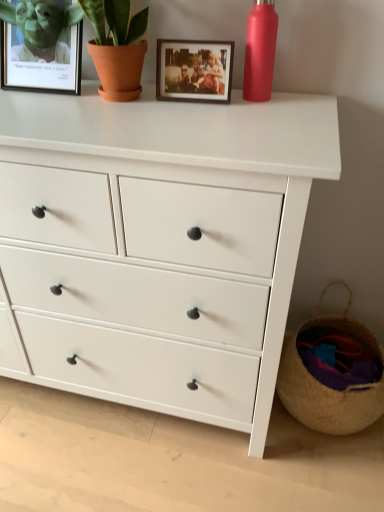
In order to face wooden photo frame at upper center, which is counted as the 2th picture frame, starting from the left, should I rotate leftwards or rightwards?

Turn right by 0.069 degrees to look at wooden photo frame at upper center, which is counted as the 2th picture frame, starting from the left.

What do you see at coordinates (156, 246) in the screenshot? The image size is (384, 512). I see `white matte chest of drawers at center` at bounding box center [156, 246].

You are a GUI agent. You are given a task and a screenshot of the screen. Output one action in this format:
    pyautogui.click(x=<x>, y=<y>)
    Task: Click on the woven straw basket at lower right
    This screenshot has height=512, width=384.
    Given the screenshot: What is the action you would take?
    pyautogui.click(x=332, y=373)

Considering the points (176, 95) and (146, 207), which point is behind, point (176, 95) or point (146, 207)?

Point (176, 95)

Is wooden photo frame at upper center, which is counted as the 2th picture frame, starting from the left, spatially inside white matte chest of drawers at center, or outside of it?

wooden photo frame at upper center, which is counted as the 2th picture frame, starting from the left, is spatially situated outside white matte chest of drawers at center.

Could you tell me if wooden photo frame at upper center, which is counted as the 2th picture frame, starting from the left, is facing white matte chest of drawers at center?

No, wooden photo frame at upper center, which is counted as the 2th picture frame, starting from the left, is not facing towards white matte chest of drawers at center.

From the image's perspective, between wooden photo frame at upper center, which is counted as the 2th picture frame, starting from the left, and white matte chest of drawers at center, which one is located above?

wooden photo frame at upper center, which is counted as the 2th picture frame, starting from the left, is shown above in the image.

Choose the correct answer: Is wooden photo frame at upper center, the 1th picture frame from the right, inside woven straw basket at lower right or outside it?

wooden photo frame at upper center, the 1th picture frame from the right, is outside woven straw basket at lower right.

Could you tell me if wooden photo frame at upper center, which is counted as the 2th picture frame, starting from the left, is turned towards woven straw basket at lower right?

No, wooden photo frame at upper center, which is counted as the 2th picture frame, starting from the left, is not turned towards woven straw basket at lower right.

From the image's perspective, between wooden photo frame at upper center, the 1th picture frame from the right, and woven straw basket at lower right, who is located below?

From the image's view, woven straw basket at lower right is below.

From a real-world perspective, is wooden photo frame at upper center, the 1th picture frame from the right, physically located above or below woven straw basket at lower right?

In terms of real-world spatial position, wooden photo frame at upper center, the 1th picture frame from the right, is above woven straw basket at lower right.

From a real-world perspective, which picture frame is the 2nd one above the white matte chest of drawers at center? Please provide its 2D coordinates.

[(41, 45)]

Based on the photo, from a real-world perspective, is white matte chest of drawers at center positioned over matte black picture frame at upper left, the 2th picture frame viewed from the right, based on gravity?

Incorrect, from a real-world perspective, white matte chest of drawers at center is lower than matte black picture frame at upper left, the 2th picture frame viewed from the right.

Between point (203, 260) and point (70, 36), which one is positioned behind?

The point (70, 36) is farther.

Is woven straw basket at lower right far away from matte red bottle at upper right?

Actually, woven straw basket at lower right and matte red bottle at upper right are a little close together.

Is woven straw basket at lower right further to camera compared to matte red bottle at upper right?

Yes, it is behind matte red bottle at upper right.

In the scene shown: Which of these two, woven straw basket at lower right or matte red bottle at upper right, is wider?

With larger width is woven straw basket at lower right.

Find the location of a particular element. The image size is (384, 512). chest of drawers on the left of matte red bottle at upper right is located at coordinates [x=156, y=246].

Between white matte chest of drawers at center and matte red bottle at upper right, which one has larger size?

With larger size is white matte chest of drawers at center.

Is white matte chest of drawers at center thinner than matte red bottle at upper right?

Incorrect, the width of white matte chest of drawers at center is not less than that of matte red bottle at upper right.

Is point (58, 116) in front of point (268, 56)?

Yes, point (58, 116) is in front of point (268, 56).

Is point (381, 385) more distant than point (262, 349)?

Yes, it is.

From the image's perspective, is woven straw basket at lower right above or below white matte chest of drawers at center?

woven straw basket at lower right is situated lower than white matte chest of drawers at center in the image.

Considering the positions of objects woven straw basket at lower right and white matte chest of drawers at center in the image provided, who is more to the left, woven straw basket at lower right or white matte chest of drawers at center?

Positioned to the left is white matte chest of drawers at center.

Who is shorter, woven straw basket at lower right or white matte chest of drawers at center?

With less height is woven straw basket at lower right.

From the image's perspective, which is below, matte black picture frame at upper left, marked as the 1th picture frame in a left-to-right arrangement, or matte red bottle at upper right?

From the image's view, matte red bottle at upper right is below.

Locate an element on the screen. The height and width of the screenshot is (512, 384). bottle in front of the matte black picture frame at upper left, marked as the 1th picture frame in a left-to-right arrangement is located at coordinates point(260,51).

Is the position of matte black picture frame at upper left, the 2th picture frame viewed from the right, less distant than that of matte red bottle at upper right?

No, matte black picture frame at upper left, the 2th picture frame viewed from the right, is further to the viewer.

I want to click on the 1st picture frame behind the white matte chest of drawers at center, starting your count from the anchor, so click(x=194, y=70).

Locate an element on the screen. the 1st picture frame located above the woven straw basket at lower right (from a real-world perspective) is located at coordinates (194, 70).

When comparing their distances from matte red bottle at upper right, does woven straw basket at lower right or matte black picture frame at upper left, marked as the 1th picture frame in a left-to-right arrangement, seem further?

woven straw basket at lower right lies further to matte red bottle at upper right than the other object.

From the picture: When comparing their distances from matte black picture frame at upper left, the 2th picture frame viewed from the right, does woven straw basket at lower right or matte red bottle at upper right seem closer?

matte red bottle at upper right is closer to matte black picture frame at upper left, the 2th picture frame viewed from the right.

In the scene shown: Which object lies further to the anchor point wooden photo frame at upper center, which is counted as the 2th picture frame, starting from the left, white matte chest of drawers at center or matte black picture frame at upper left, the 2th picture frame viewed from the right?

white matte chest of drawers at center is further to wooden photo frame at upper center, which is counted as the 2th picture frame, starting from the left.

Which object lies nearer to the anchor point matte red bottle at upper right, wooden photo frame at upper center, which is counted as the 2th picture frame, starting from the left, or matte black picture frame at upper left, the 2th picture frame viewed from the right?

The object closer to matte red bottle at upper right is wooden photo frame at upper center, which is counted as the 2th picture frame, starting from the left.

Which object lies nearer to the anchor point matte red bottle at upper right, woven straw basket at lower right or wooden photo frame at upper center, the 1th picture frame from the right?

wooden photo frame at upper center, the 1th picture frame from the right, is positioned closer to the anchor matte red bottle at upper right.

Looking at the image, which one is located further to white matte chest of drawers at center, wooden photo frame at upper center, which is counted as the 2th picture frame, starting from the left, or woven straw basket at lower right?

woven straw basket at lower right.

Estimate the real-world distances between objects in this image. Which object is closer to white matte chest of drawers at center, matte red bottle at upper right or matte black picture frame at upper left, marked as the 1th picture frame in a left-to-right arrangement?

The object closer to white matte chest of drawers at center is matte black picture frame at upper left, marked as the 1th picture frame in a left-to-right arrangement.

When comparing their distances from matte black picture frame at upper left, the 2th picture frame viewed from the right, does matte red bottle at upper right or white matte chest of drawers at center seem closer?

The object closer to matte black picture frame at upper left, the 2th picture frame viewed from the right, is white matte chest of drawers at center.

Where is `picture frame that lies between matte black picture frame at upper left, the 2th picture frame viewed from the right, and woven straw basket at lower right from top to bottom`? The width and height of the screenshot is (384, 512). picture frame that lies between matte black picture frame at upper left, the 2th picture frame viewed from the right, and woven straw basket at lower right from top to bottom is located at coordinates (194, 70).

Identify the location of bottle between matte black picture frame at upper left, the 2th picture frame viewed from the right, and white matte chest of drawers at center from top to bottom. (260, 51).

Where is `picture frame between matte black picture frame at upper left, marked as the 1th picture frame in a left-to-right arrangement, and white matte chest of drawers at center from top to bottom`? picture frame between matte black picture frame at upper left, marked as the 1th picture frame in a left-to-right arrangement, and white matte chest of drawers at center from top to bottom is located at coordinates (194, 70).

This screenshot has width=384, height=512. Identify the location of bottle between matte black picture frame at upper left, the 2th picture frame viewed from the right, and woven straw basket at lower right, in the vertical direction. coord(260,51).